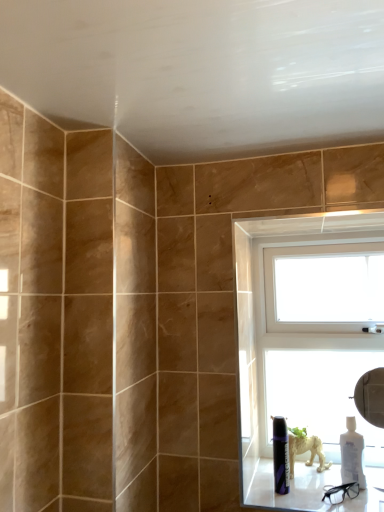
Question: Does white glossy bottle at lower right have a lesser width compared to white plastic window at upper right?

Choices:
 (A) yes
 (B) no

Answer: (A)

Question: Does white glossy bottle at lower right have a greater width compared to white plastic window at upper right?

Choices:
 (A) yes
 (B) no

Answer: (B)

Question: Is white glossy bottle at lower right further to camera compared to white plastic window at upper right?

Choices:
 (A) yes
 (B) no

Answer: (B)

Question: Is the position of white glossy bottle at lower right less distant than that of white plastic window at upper right?

Choices:
 (A) yes
 (B) no

Answer: (A)

Question: Considering the relative positions of white glossy bottle at lower right and white plastic window at upper right in the image provided, is white glossy bottle at lower right to the left of white plastic window at upper right from the viewer's perspective?

Choices:
 (A) yes
 (B) no

Answer: (B)

Question: Is point (345, 339) closer or farther from the camera than point (309, 481)?

Choices:
 (A) farther
 (B) closer

Answer: (A)

Question: Is white plastic window at upper right taller or shorter than white glossy window sill at lower right?

Choices:
 (A) short
 (B) tall

Answer: (B)

Question: In terms of width, does white plastic window at upper right look wider or thinner when compared to white glossy window sill at lower right?

Choices:
 (A) wide
 (B) thin

Answer: (B)

Question: Visually, is white plastic window at upper right positioned to the left or to the right of white glossy window sill at lower right?

Choices:
 (A) left
 (B) right

Answer: (B)

Question: In terms of width, does white glossy bottle at lower right look wider or thinner when compared to matte black can at lower right?

Choices:
 (A) thin
 (B) wide

Answer: (B)

Question: From the image's perspective, is white glossy bottle at lower right above or below matte black can at lower right?

Choices:
 (A) below
 (B) above

Answer: (A)

Question: Is white glossy bottle at lower right bigger or smaller than matte black can at lower right?

Choices:
 (A) big
 (B) small

Answer: (A)

Question: Choose the correct answer: Is white glossy bottle at lower right inside matte black can at lower right or outside it?

Choices:
 (A) outside
 (B) inside

Answer: (A)

Question: Would you say white glossy window sill at lower right is to the left or to the right of white plastic window at upper right in the picture?

Choices:
 (A) right
 (B) left

Answer: (B)

Question: Considering the positions of white glossy window sill at lower right and white plastic window at upper right in the image, is white glossy window sill at lower right wider or thinner than white plastic window at upper right?

Choices:
 (A) thin
 (B) wide

Answer: (B)